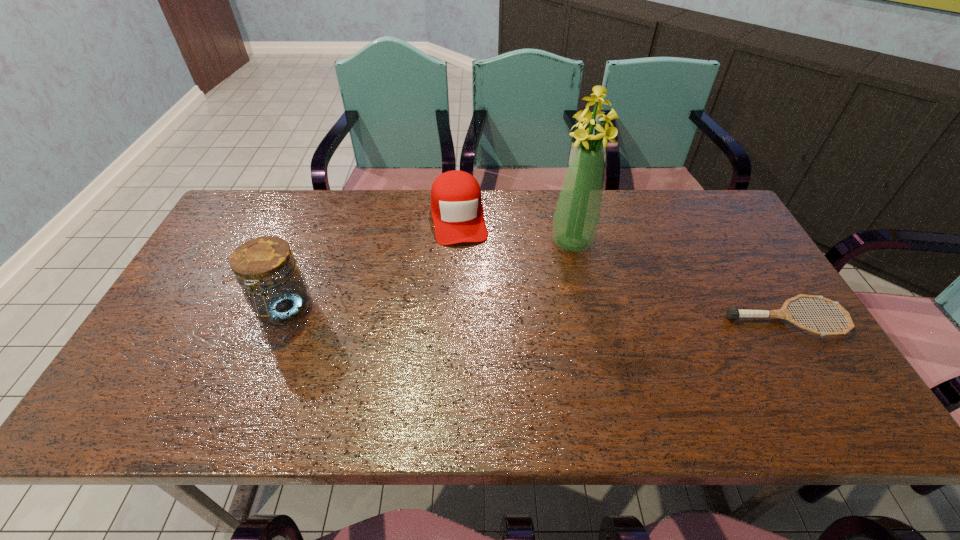
The image size is (960, 540). Identify the location of vacant space on the desktop that is between the jar and the tennis racket and is positioned on the front-facing side of the second object from right to left. (561, 315).

I want to click on free spot on the desktop that is between the jar and the shortest object and is positioned on the front-facing side of the third tallest object, so click(475, 313).